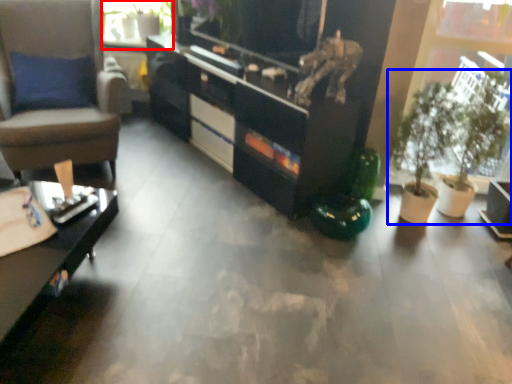
Question: Among these objects, which one is nearest to the camera, window screen (highlighted by a red box) or houseplant (highlighted by a blue box)?

Choices:
 (A) window screen
 (B) houseplant

Answer: (B)